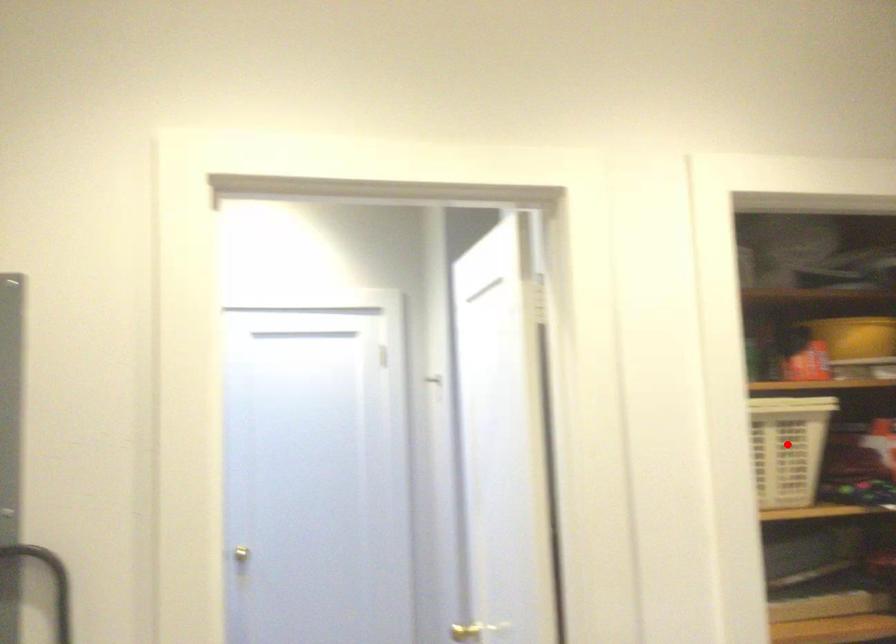
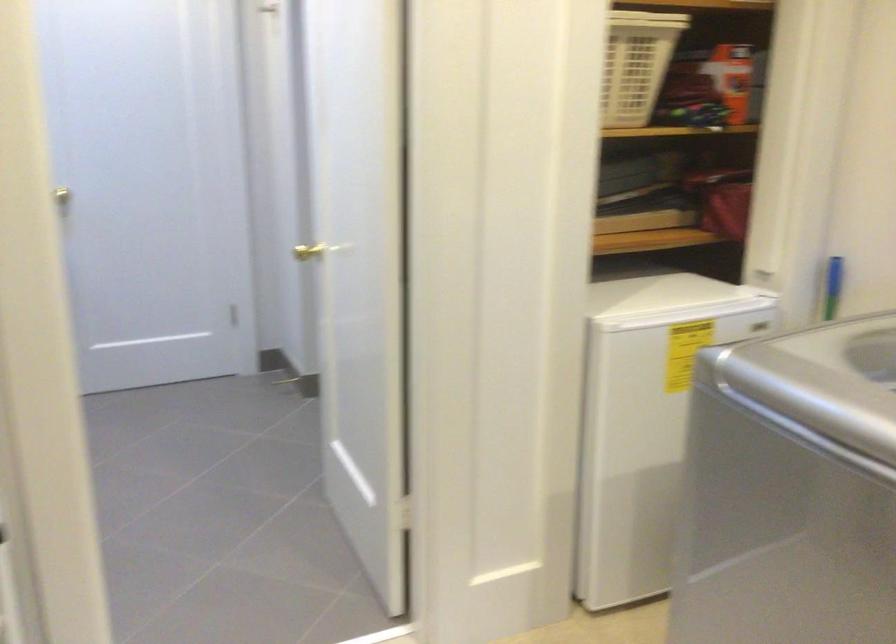
Where in the second image is the point corresponding to the highlighted location from the first image?

(636, 64)